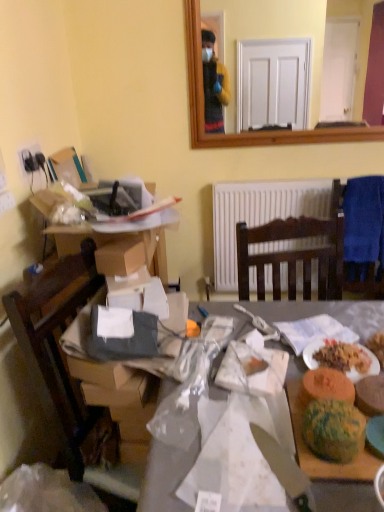
Question: Does green textured bread at right, which is counted as the 2th food, starting from the right, have a greater height compared to white paper plate at lower right?

Choices:
 (A) yes
 (B) no

Answer: (A)

Question: Does green textured bread at right, which is counted as the 2th food, starting from the right, have a lesser height compared to white paper plate at lower right?

Choices:
 (A) no
 (B) yes

Answer: (A)

Question: Is green textured bread at right, which is counted as the second food, starting from the left, far away from white paper plate at lower right?

Choices:
 (A) yes
 (B) no

Answer: (B)

Question: Is green textured bread at right, which is counted as the 2th food, starting from the right, closer to the viewer compared to white paper plate at lower right?

Choices:
 (A) no
 (B) yes

Answer: (B)

Question: Would you say green textured bread at right, which is counted as the second food, starting from the left, is outside white paper plate at lower right?

Choices:
 (A) no
 (B) yes

Answer: (B)

Question: Considering the relative positions of green textured bread at right, which is counted as the 2th food, starting from the right, and white paper plate at lower right in the image provided, is green textured bread at right, which is counted as the 2th food, starting from the right, to the left of white paper plate at lower right from the viewer's perspective?

Choices:
 (A) no
 (B) yes

Answer: (A)

Question: Is green textured bread at lower right, which is counted as the 3th food, starting from the right, facing away from white paper plate at lower right?

Choices:
 (A) yes
 (B) no

Answer: (A)

Question: Is green textured bread at lower right, which is counted as the 3th food, starting from the right, positioned beyond the bounds of white paper plate at lower right?

Choices:
 (A) yes
 (B) no

Answer: (A)

Question: From a real-world perspective, is green textured bread at lower right, which is counted as the 3th food, starting from the right, on top of white paper plate at lower right?

Choices:
 (A) yes
 (B) no

Answer: (A)

Question: From the image's perspective, would you say green textured bread at lower right, the 1th food when ordered from left to right, is positioned over white paper plate at lower right?

Choices:
 (A) no
 (B) yes

Answer: (A)

Question: Considering the relative sizes of green textured bread at lower right, which is counted as the 3th food, starting from the right, and white paper plate at lower right in the image provided, is green textured bread at lower right, which is counted as the 3th food, starting from the right, thinner than white paper plate at lower right?

Choices:
 (A) yes
 (B) no

Answer: (A)

Question: From the image's perspective, is green textured bread at lower right, which is counted as the 3th food, starting from the right, beneath white paper plate at lower right?

Choices:
 (A) no
 (B) yes

Answer: (B)

Question: Can green textured bread at lower right, which is counted as the 3th food, starting from the right, be found inside blue fabric chair at right?

Choices:
 (A) no
 (B) yes

Answer: (A)